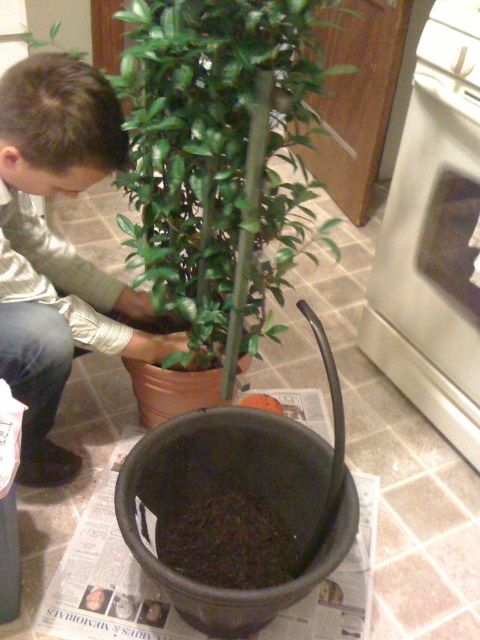
Question: Which point appears farthest from the camera in this image?

Choices:
 (A) tap(252, 196)
 (B) tap(46, 376)
 (C) tap(408, 204)

Answer: (C)

Question: Is green matte plant at center to the right of white glossy oven at right from the viewer's perspective?

Choices:
 (A) yes
 (B) no

Answer: (B)

Question: Which point appears farthest from the camera in this image?

Choices:
 (A) (29, 472)
 (B) (470, 176)

Answer: (A)

Question: Among these points, which one is nearest to the camera?

Choices:
 (A) (34, 364)
 (B) (156, 81)
 (C) (409, 228)

Answer: (B)

Question: Does green matte plant at center have a lesser width compared to matte green plant at center?

Choices:
 (A) no
 (B) yes

Answer: (A)

Question: Can you confirm if green matte plant at center is positioned above matte green plant at center?

Choices:
 (A) no
 (B) yes

Answer: (B)